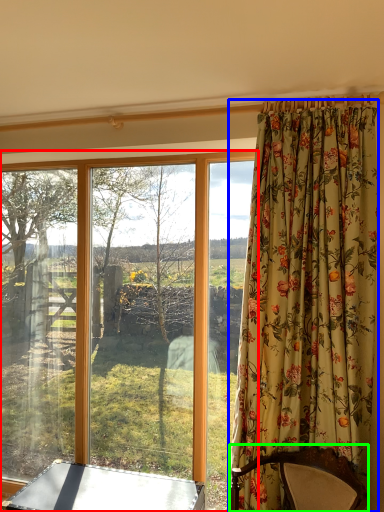
Question: Considering the real-world distances, which object is farthest from window (highlighted by a red box)? curtain (highlighted by a blue box) or furniture (highlighted by a green box)?

Choices:
 (A) curtain
 (B) furniture

Answer: (B)